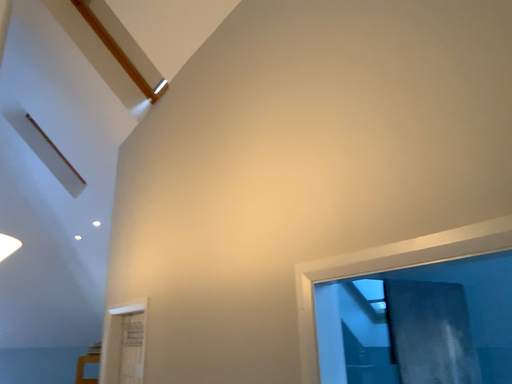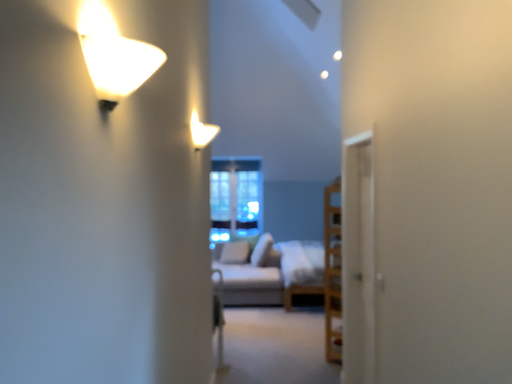
Question: Which way did the camera rotate in the video?

Choices:
 (A) rotated right
 (B) rotated left

Answer: (B)